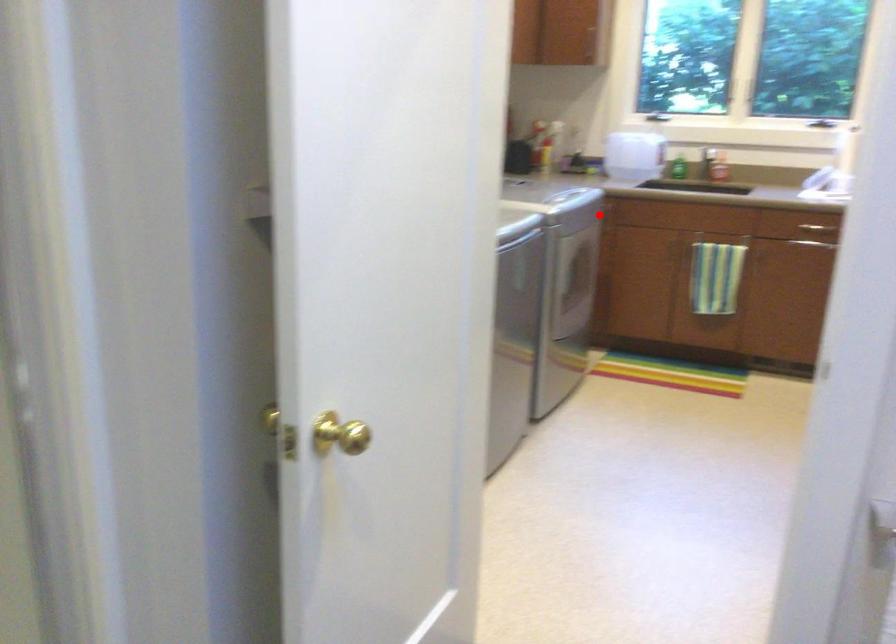
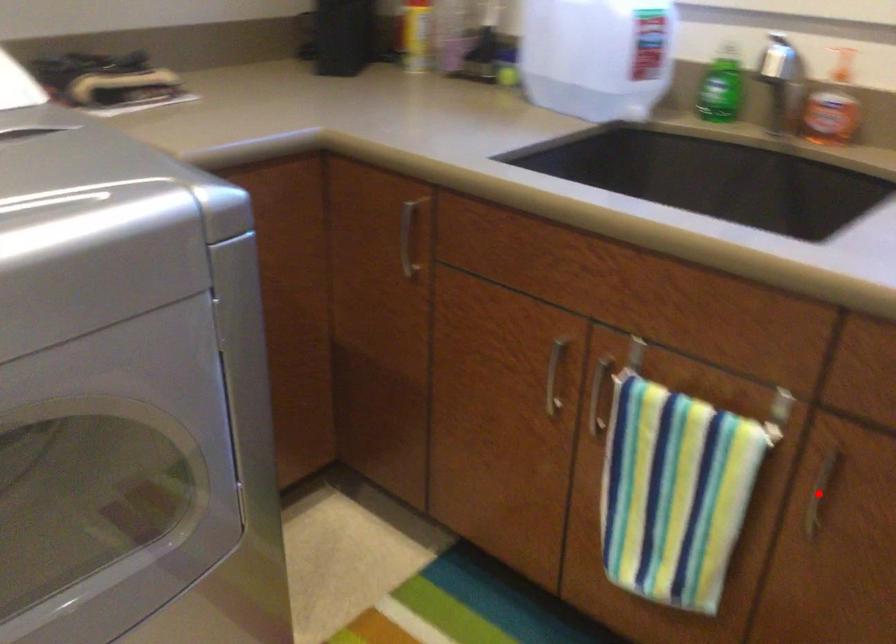
I am providing you with two images of the same scene from different viewpoints. A red point is marked on the first image and another point is marked on the second image. Is the marked point in image1 the same physical position as the marked point in image2?

No